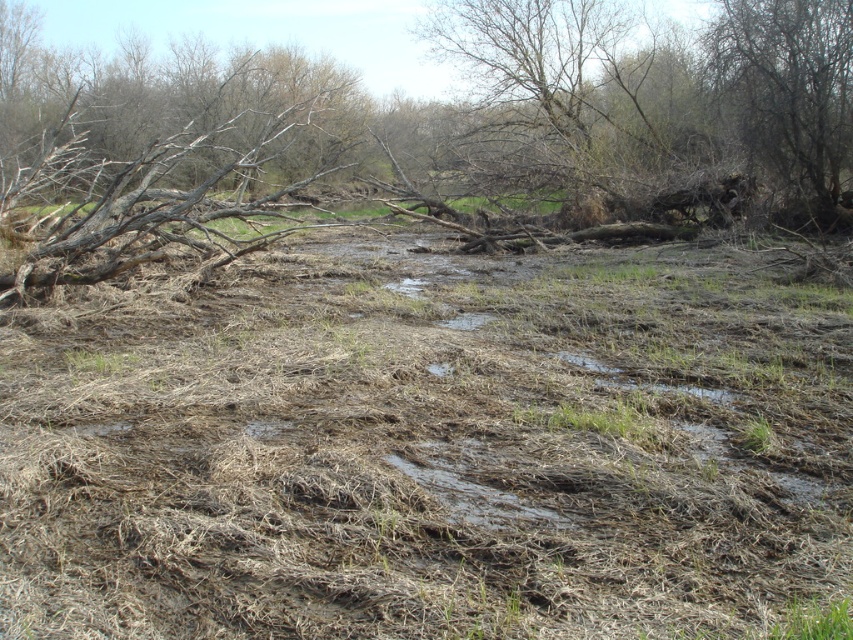
Is brown dry grass at center closer to camera compared to bare branches at upper right?

That is True.

The width and height of the screenshot is (853, 640). In order to click on brown dry grass at center in this screenshot , I will do `click(426, 444)`.